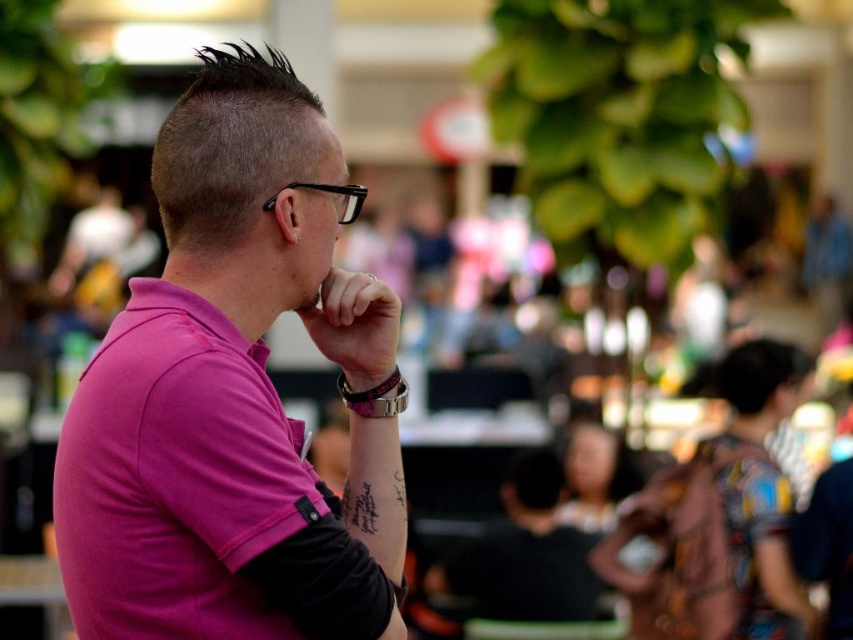
You are a photographer who wants to ensure the pink matte shirt at center is the main focus of the photo. Given its position at coordinates, how does its placement contribute to the composition?

The pink matte shirt at center is strategically placed at coordinates, which helps it stand out as the main focus due to the shallow depth of field in the image.